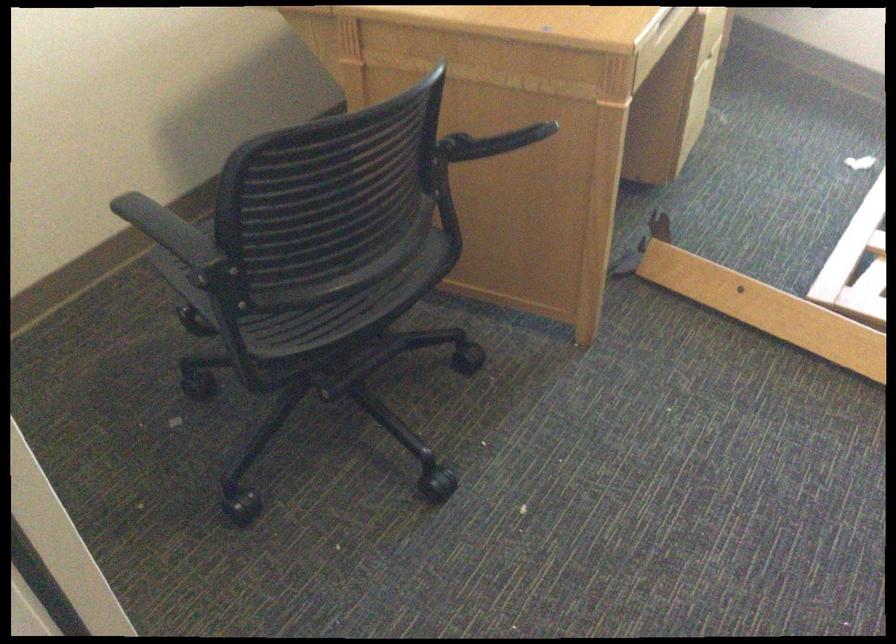
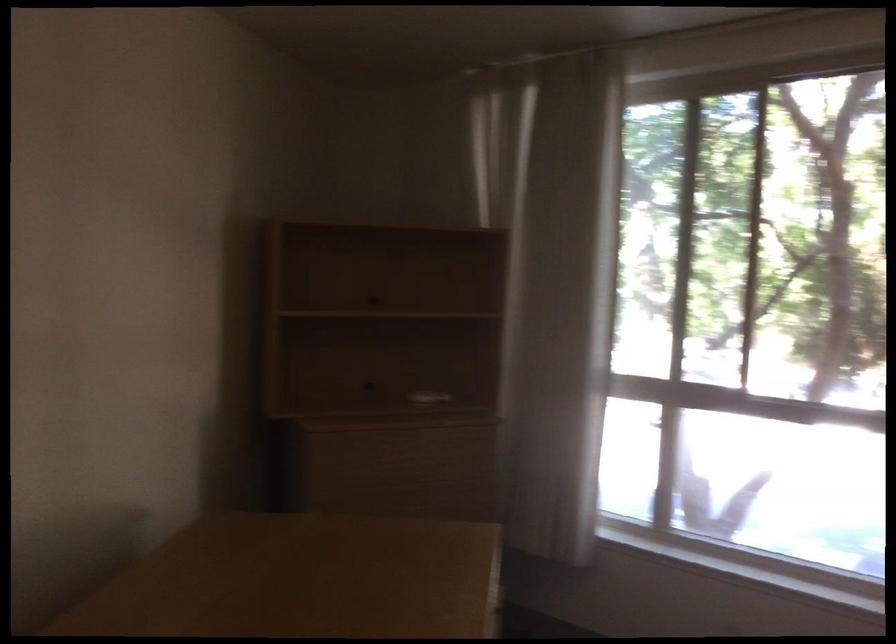
First-person continuous shooting, in which direction is the camera rotating?

The rotation direction of the camera is right-up.